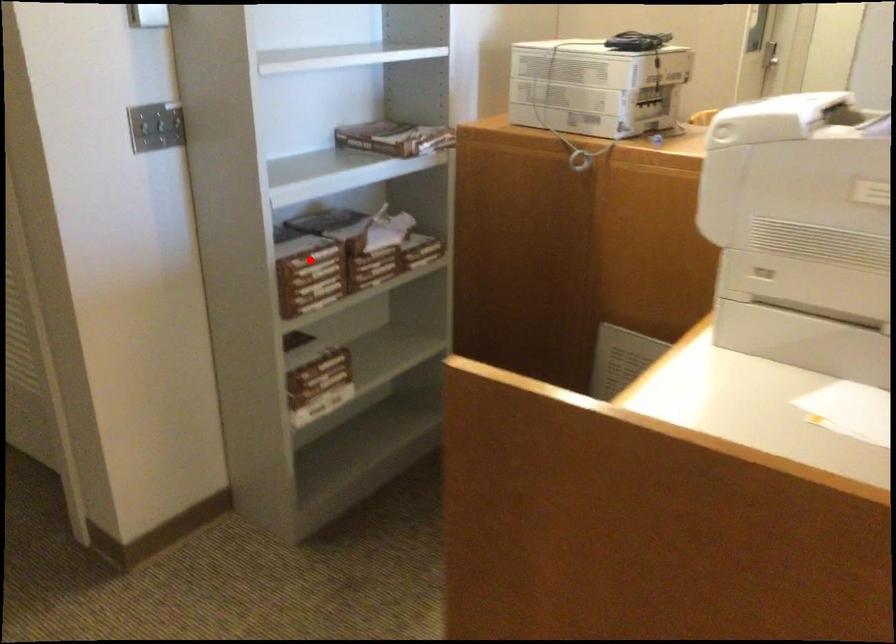
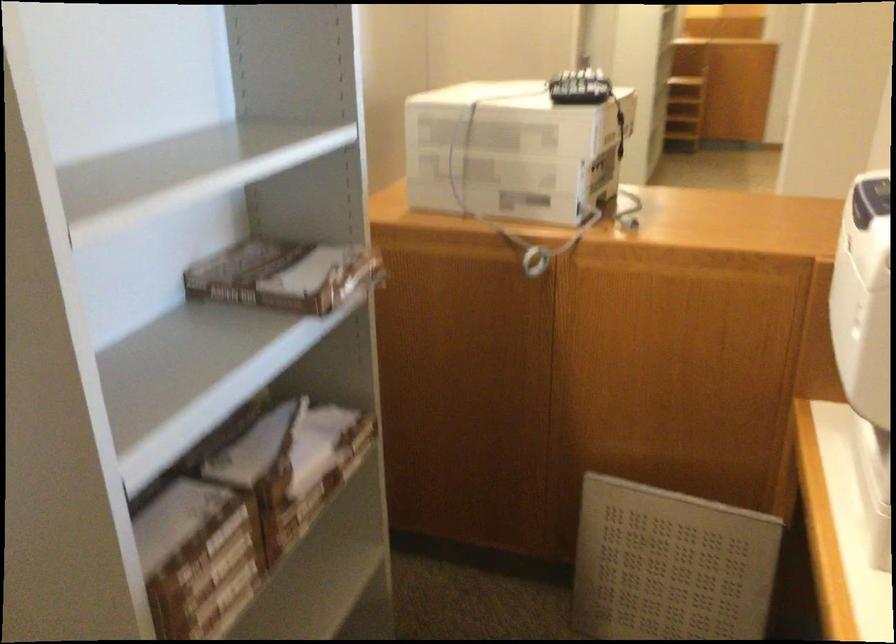
Where in the second image is the point corresponding to the highlighted location from the first image?

(209, 556)